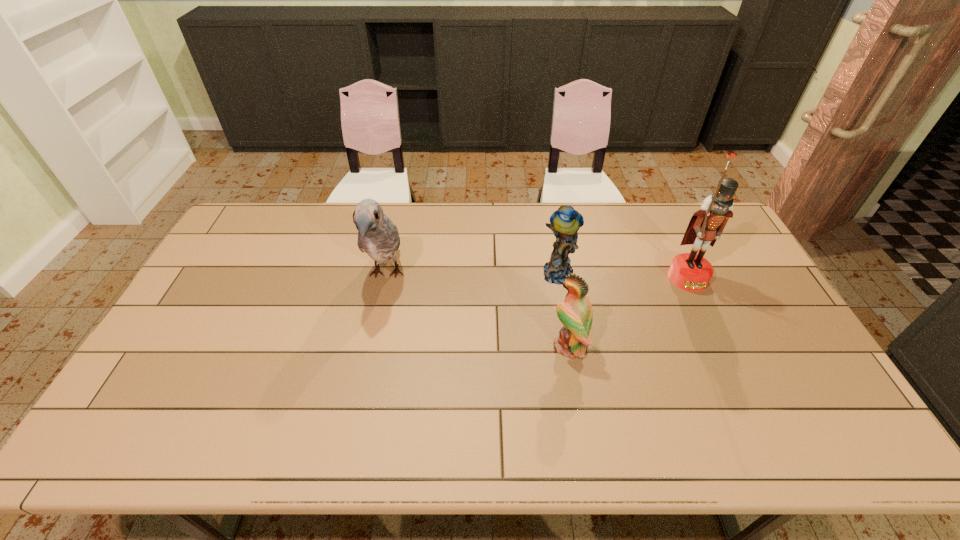
Image resolution: width=960 pixels, height=540 pixels. Find the location of `nutcracker`. nutcracker is located at coordinates (692, 272).

I want to click on the rightmost object, so click(692, 272).

In order to click on the leftmost parrot in this screenshot , I will do `click(377, 235)`.

Where is `the shortest parrot`? the shortest parrot is located at coordinates (575, 313).

Where is `the shortest object`? The height and width of the screenshot is (540, 960). the shortest object is located at coordinates (575, 313).

You are a GUI agent. You are given a task and a screenshot of the screen. Output one action in this format:
    pyautogui.click(x=<x>, y=<y>)
    Task: Click on the vacant area situated on the front-facing side of the nutcracker
    This screenshot has width=960, height=540.
    Given the screenshot: What is the action you would take?
    pyautogui.click(x=748, y=407)

Locate an element on the screen. free spot located 0.370m on the front-facing side of the leftmost object is located at coordinates (354, 424).

Locate an element on the screen. Image resolution: width=960 pixels, height=540 pixels. vacant space located on the front-facing side of the nearest object is located at coordinates (418, 346).

Where is `free spot located 0.080m on the front-facing side of the nearest object`? free spot located 0.080m on the front-facing side of the nearest object is located at coordinates (522, 346).

Where is `vacant space located on the front-facing side of the nearest object`? The height and width of the screenshot is (540, 960). vacant space located on the front-facing side of the nearest object is located at coordinates (410, 346).